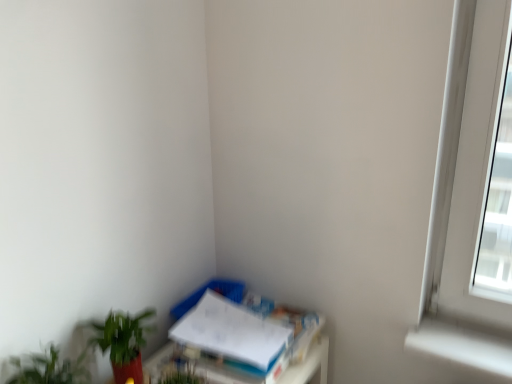
The width and height of the screenshot is (512, 384). I want to click on white paper at lower right, so click(x=230, y=331).

What do you see at coordinates (122, 342) in the screenshot? The height and width of the screenshot is (384, 512). I see `green matte plant at lower left, which is the 2th houseplant in front-to-back order` at bounding box center [122, 342].

Locate an element on the screen. The width and height of the screenshot is (512, 384). green leafy plant at lower left, acting as the 1th houseplant starting from the front is located at coordinates (48, 368).

Which of these two, green matte plant at lower left, which appears as the first houseplant when viewed from the back, or white paper at lower right, is wider?

white paper at lower right.

Is green matte plant at lower left, which appears as the first houseplant when viewed from the back, located outside white paper at lower right?

Yes, green matte plant at lower left, which appears as the first houseplant when viewed from the back, is outside of white paper at lower right.

Is green leafy plant at lower left, acting as the second houseplant starting from the back, placed right next to white paper at lower right?

green leafy plant at lower left, acting as the second houseplant starting from the back, is not next to white paper at lower right, and they're not touching.

How many degrees apart are the facing directions of green leafy plant at lower left, acting as the 1th houseplant starting from the front, and white paper at lower right?

green leafy plant at lower left, acting as the 1th houseplant starting from the front, and white paper at lower right are facing 0.594 degrees away from each other.

Could you tell me if green leafy plant at lower left, acting as the 1th houseplant starting from the front, is facing white paper at lower right?

No, green leafy plant at lower left, acting as the 1th houseplant starting from the front, is not facing towards white paper at lower right.

Would you say green matte plant at lower left, which appears as the first houseplant when viewed from the back, is to the left or to the right of green leafy plant at lower left, acting as the 1th houseplant starting from the front, in the picture?

Clearly, green matte plant at lower left, which appears as the first houseplant when viewed from the back, is on the right of green leafy plant at lower left, acting as the 1th houseplant starting from the front, in the image.

Is green matte plant at lower left, which is the 2th houseplant in front-to-back order, in front of or behind green leafy plant at lower left, acting as the second houseplant starting from the back, in the image?

green matte plant at lower left, which is the 2th houseplant in front-to-back order, is behind green leafy plant at lower left, acting as the second houseplant starting from the back.

Is green matte plant at lower left, which appears as the first houseplant when viewed from the back, oriented away from green leafy plant at lower left, acting as the second houseplant starting from the back?

No.

Who is bigger, green matte plant at lower left, which is the 2th houseplant in front-to-back order, or green leafy plant at lower left, acting as the 1th houseplant starting from the front?

With larger size is green matte plant at lower left, which is the 2th houseplant in front-to-back order.

Relative to green matte plant at lower left, which appears as the first houseplant when viewed from the back, is white paper at lower right in front or behind?

Visually, white paper at lower right is located behind green matte plant at lower left, which appears as the first houseplant when viewed from the back.

From a real-world perspective, which object stands above the other?

From a 3D spatial view, green matte plant at lower left, which appears as the first houseplant when viewed from the back, is above.

In the scene shown: Are white paper at lower right and green matte plant at lower left, which is the 2th houseplant in front-to-back order, far apart?

They are positioned close to each other.

Considering the sizes of objects white paper at lower right and green matte plant at lower left, which appears as the first houseplant when viewed from the back, in the image provided, who is bigger, white paper at lower right or green matte plant at lower left, which appears as the first houseplant when viewed from the back,?

Bigger between the two is white paper at lower right.

Between white paper at lower right and green leafy plant at lower left, acting as the second houseplant starting from the back, which one has more height?

green leafy plant at lower left, acting as the second houseplant starting from the back, is taller.

From a real-world perspective, is white paper at lower right below green leafy plant at lower left, acting as the 1th houseplant starting from the front?

Yes, from a real-world perspective, white paper at lower right is under green leafy plant at lower left, acting as the 1th houseplant starting from the front.

Is green leafy plant at lower left, acting as the 1th houseplant starting from the front, at the back of white paper at lower right?

No, white paper at lower right's orientation is not away from green leafy plant at lower left, acting as the 1th houseplant starting from the front.

From the image's perspective, is green leafy plant at lower left, acting as the 1th houseplant starting from the front, positioned above or below green matte plant at lower left, which is the 2th houseplant in front-to-back order?

Clearly, from the image's perspective, green leafy plant at lower left, acting as the 1th houseplant starting from the front, is below green matte plant at lower left, which is the 2th houseplant in front-to-back order.

Which object is thinner, green leafy plant at lower left, acting as the 1th houseplant starting from the front, or green matte plant at lower left, which appears as the first houseplant when viewed from the back?

Thinner between the two is green matte plant at lower left, which appears as the first houseplant when viewed from the back.

Is green leafy plant at lower left, acting as the 1th houseplant starting from the front, aimed at green matte plant at lower left, which appears as the first houseplant when viewed from the back?

No.

Is point (58, 362) closer or farther from the camera than point (146, 329)?

Clearly, point (58, 362) is closer to the camera than point (146, 329).

In order to click on paperback book behind the green matte plant at lower left, which is the 2th houseplant in front-to-back order in this screenshot , I will do `click(230, 331)`.

The image size is (512, 384). I want to click on paperback book on the right of green leafy plant at lower left, acting as the second houseplant starting from the back, so click(230, 331).

Based on their spatial positions, is green matte plant at lower left, which is the 2th houseplant in front-to-back order, or white paper at lower right further from green leafy plant at lower left, acting as the second houseplant starting from the back?

The object further to green leafy plant at lower left, acting as the second houseplant starting from the back, is white paper at lower right.

Considering their positions, is green leafy plant at lower left, acting as the 1th houseplant starting from the front, positioned closer to green matte plant at lower left, which is the 2th houseplant in front-to-back order, than white paper at lower right?

green leafy plant at lower left, acting as the 1th houseplant starting from the front.

Considering their positions, is green matte plant at lower left, which appears as the first houseplant when viewed from the back, positioned closer to white paper at lower right than green leafy plant at lower left, acting as the second houseplant starting from the back?

The object closer to white paper at lower right is green matte plant at lower left, which appears as the first houseplant when viewed from the back.

Estimate the real-world distances between objects in this image. Which object is further from green matte plant at lower left, which appears as the first houseplant when viewed from the back, white paper at lower right or green leafy plant at lower left, acting as the 1th houseplant starting from the front?

Among the two, white paper at lower right is located further to green matte plant at lower left, which appears as the first houseplant when viewed from the back.

Which object lies further to the anchor point green leafy plant at lower left, acting as the second houseplant starting from the back, white paper at lower right or green matte plant at lower left, which is the 2th houseplant in front-to-back order?

white paper at lower right is further to green leafy plant at lower left, acting as the second houseplant starting from the back.

Considering their positions, is green leafy plant at lower left, acting as the second houseplant starting from the back, positioned further to white paper at lower right than green matte plant at lower left, which is the 2th houseplant in front-to-back order?

Among the two, green leafy plant at lower left, acting as the second houseplant starting from the back, is located further to white paper at lower right.

This screenshot has width=512, height=384. What are the coordinates of `houseplant situated between green leafy plant at lower left, acting as the 1th houseplant starting from the front, and white paper at lower right from left to right` in the screenshot? It's located at (122, 342).